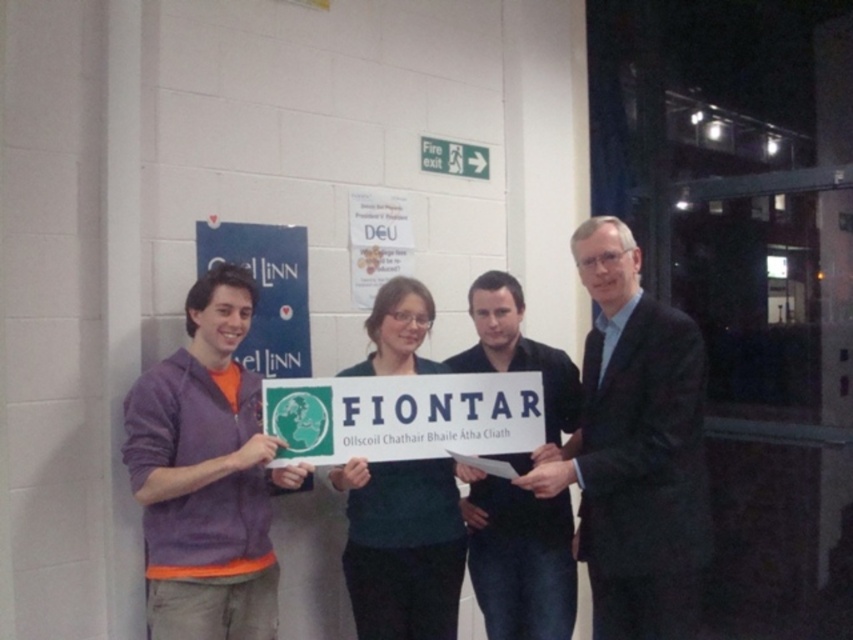
Question: Considering the real-world distances, which object is farthest from the dark suit at center?

Choices:
 (A) purple sweater at left
 (B) dark blue shirt at center

Answer: (A)

Question: Does purple sweater at left have a larger size compared to dark blue shirt at center?

Choices:
 (A) no
 (B) yes

Answer: (B)

Question: Is dark suit at center to the right of purple sweater at left from the viewer's perspective?

Choices:
 (A) no
 (B) yes

Answer: (B)

Question: Which point is farther to the camera?

Choices:
 (A) dark suit at center
 (B) purple sweater at left
 (C) dark blue shirt at center

Answer: (C)

Question: Which point is farther to the camera?

Choices:
 (A) (648, 588)
 (B) (469, 541)

Answer: (B)

Question: In this image, where is dark suit at center located relative to purple sweater at left?

Choices:
 (A) right
 (B) left

Answer: (A)